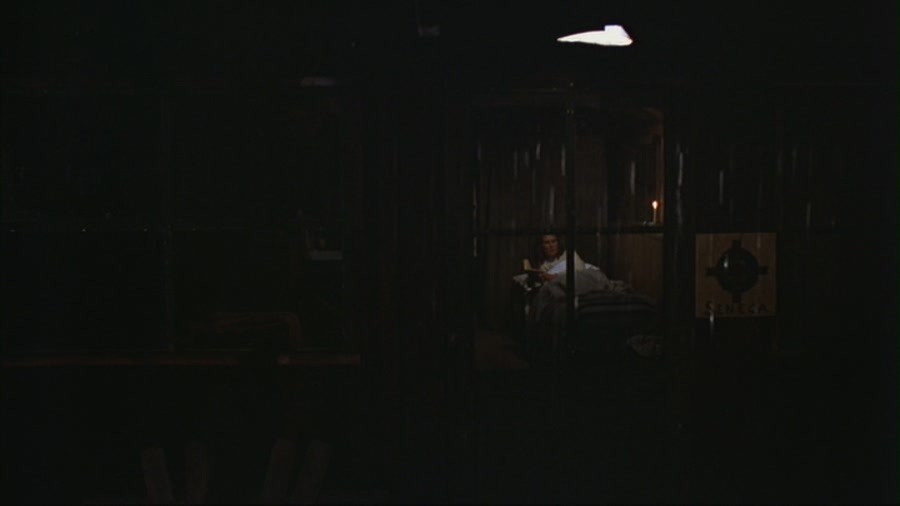
Locate an element on the screen. The width and height of the screenshot is (900, 506). light is located at coordinates (613, 35).